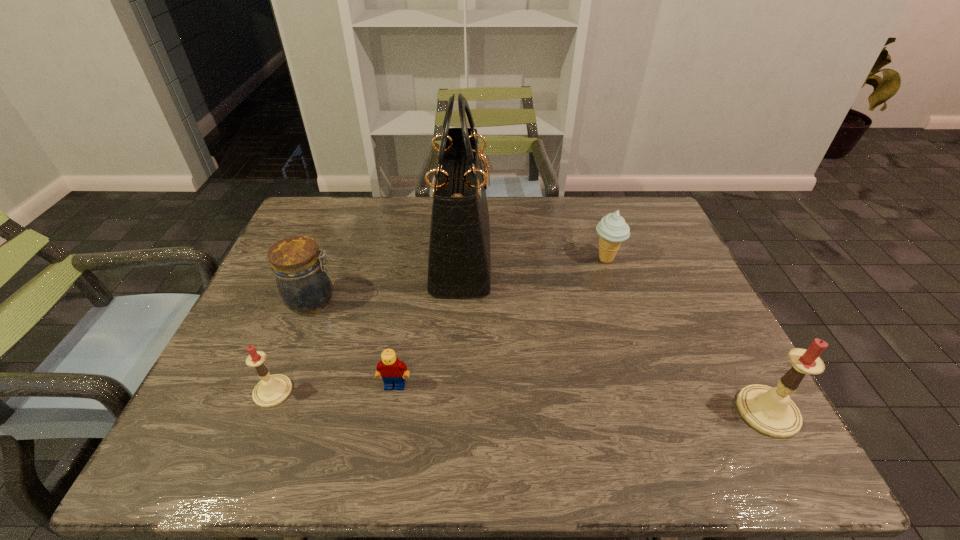
At what (x,y) coordinates should I click in order to perform the action: click on the shorter candle. Please return your answer as a coordinate pair (x, y). Looking at the image, I should click on (272, 390).

Identify the location of the taller candle. (769, 410).

Locate an element on the screen. the rightmost object is located at coordinates (769, 410).

The height and width of the screenshot is (540, 960). What are the coordinates of `the second object from right to left` in the screenshot? It's located at (612, 229).

The image size is (960, 540). Find the location of `the fourth object from left to right`. the fourth object from left to right is located at coordinates (459, 264).

At what (x,y) coordinates should I click in order to perform the action: click on the tallest object. Please return your answer as a coordinate pair (x, y). Image resolution: width=960 pixels, height=540 pixels. Looking at the image, I should click on (459, 264).

This screenshot has width=960, height=540. I want to click on jar, so click(x=303, y=282).

You are a GUI agent. You are given a task and a screenshot of the screen. Output one action in this format:
    pyautogui.click(x=<x>, y=<y>)
    Task: Click on the Lego
    This screenshot has width=960, height=540.
    Given the screenshot: What is the action you would take?
    pyautogui.click(x=392, y=371)

Where is `the third object from left to right`? This screenshot has height=540, width=960. the third object from left to right is located at coordinates (392, 371).

This screenshot has width=960, height=540. Identify the location of vacant space located 0.400m on the right of the shorter candle. (477, 392).